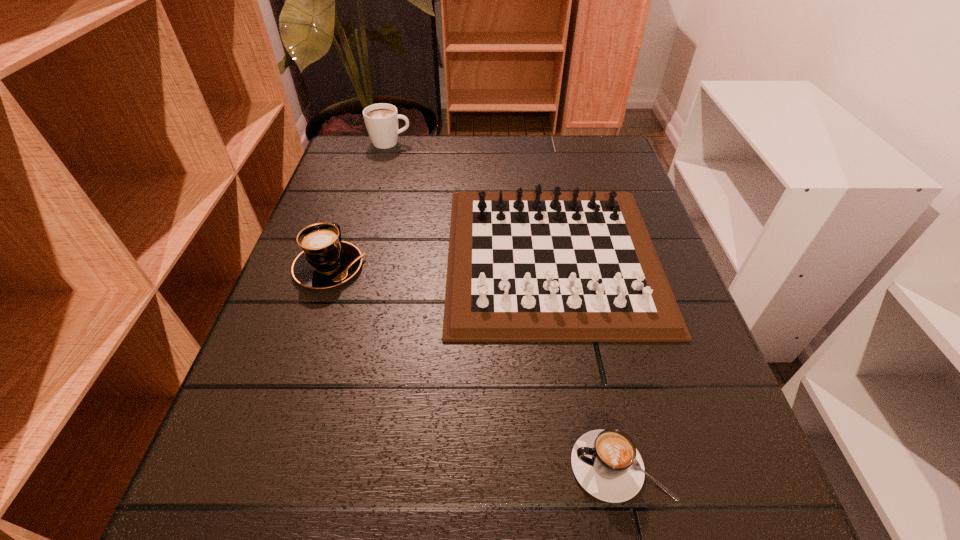
Where is `the farthest object`? This screenshot has height=540, width=960. the farthest object is located at coordinates (381, 120).

Identify the location of the second farthest cappuccino. (326, 261).

Locate an element on the screen. gameboard is located at coordinates (538, 266).

Find the location of a particular element. The image size is (960, 540). the nearest object is located at coordinates (606, 463).

You are a GUI agent. You are given a task and a screenshot of the screen. Output one action in this format:
    pyautogui.click(x=<x>, y=<y>)
    Task: Click on the rightmost cappuccino
    
    Given the screenshot: What is the action you would take?
    pyautogui.click(x=606, y=463)

At what (x,y) coordinates should I click in order to perform the action: click on vacant position located 0.370m with the handle on the side of the farthest object. Please return your answer as a coordinate pair (x, y). Looking at the image, I should click on (551, 143).

Image resolution: width=960 pixels, height=540 pixels. I want to click on vacant space located on the back of the second nearest cappuccino, so click(x=364, y=166).

Where is `vacant area located 0.160m on the left of the gameboard`? vacant area located 0.160m on the left of the gameboard is located at coordinates 367,256.

Locate an element on the screen. This screenshot has height=540, width=960. free space located 0.070m with the handle on the side of the rightmost cappuccino is located at coordinates (518, 466).

The width and height of the screenshot is (960, 540). Identify the location of vacant region located with the handle on the side of the rightmost cappuccino. (322, 466).